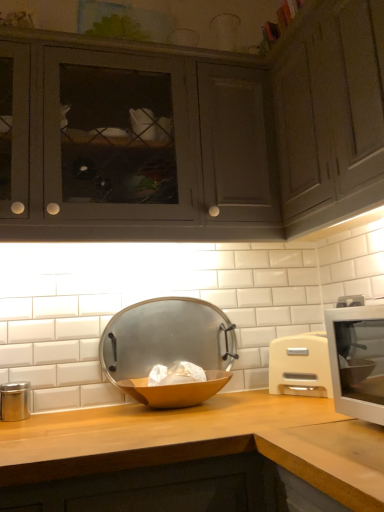
What do you see at coordinates (300, 366) in the screenshot?
I see `white plastic microwave at right` at bounding box center [300, 366].

How much space does matte gray cabinet at upper right, marked as the first cabinetry in a right-to-left arrangement, occupy horizontally?

matte gray cabinet at upper right, marked as the first cabinetry in a right-to-left arrangement, is 14.14 inches in width.

This screenshot has width=384, height=512. What do you see at coordinates (168, 348) in the screenshot? I see `metallic silver bowl at center` at bounding box center [168, 348].

Identify the location of white plastic microwave at right. (300, 366).

Which object is positioned more to the left, white plastic microwave at right or white plastic microwave at right?

From the viewer's perspective, white plastic microwave at right appears more on the left side.

Consider the image. From the image's perspective, is white plastic microwave at right above white plastic microwave at right?

Yes, from the image's perspective, white plastic microwave at right is over white plastic microwave at right.

From a real-world perspective, is white plastic microwave at right on top of white plastic microwave at right?

Yes, from a real-world perspective, white plastic microwave at right is above white plastic microwave at right.

Which of these two, wooden at center or white plastic microwave at right, is thinner?

With smaller width is white plastic microwave at right.

Find the location of `microwave oven behind the wooden at center`. microwave oven behind the wooden at center is located at coordinates (300, 366).

Considering the relative sizes of wooden at center and white plastic microwave at right in the image provided, is wooden at center bigger than white plastic microwave at right?

Correct, wooden at center is larger in size than white plastic microwave at right.

Looking at this image, from the image's perspective, is wooden at center on white plastic microwave at right?

No, from the image's perspective, wooden at center is not above white plastic microwave at right.

Which is more to the left, white plastic microwave at right or wooden bowl at center?

wooden bowl at center is more to the left.

Is white plastic microwave at right far from wooden bowl at center?

No.

Considering the sizes of objects white plastic microwave at right and wooden bowl at center in the image provided, who is wider, white plastic microwave at right or wooden bowl at center?

wooden bowl at center is wider.

Is wooden at center taller than matte gray cabinets at upper left, which ranks as the 1th cabinetry in left-to-right order?

No.

Is wooden at center wider than matte gray cabinets at upper left, which ranks as the 1th cabinetry in left-to-right order?

Yes.

Is wooden at center not within matte gray cabinets at upper left, which ranks as the 1th cabinetry in left-to-right order?

wooden at center lies outside matte gray cabinets at upper left, which ranks as the 1th cabinetry in left-to-right order,'s area.

This screenshot has width=384, height=512. What are the coordinates of `countertop below the matte gray cabinets at upper left, which ranks as the 1th cabinetry in left-to-right order (from the image's perspective)` in the screenshot? It's located at (203, 442).

Can you confirm if matte gray cabinets at upper left, which ranks as the 1th cabinetry in left-to-right order, is positioned to the right of matte gray cabinet at upper right, marked as the first cabinetry in a right-to-left arrangement?

No.

From the image's perspective, would you say matte gray cabinets at upper left, which ranks as the 1th cabinetry in left-to-right order, is shown under matte gray cabinet at upper right, marked as the first cabinetry in a right-to-left arrangement?

Result: Yes, from the image's perspective, matte gray cabinets at upper left, which ranks as the 1th cabinetry in left-to-right order, is below matte gray cabinet at upper right, marked as the first cabinetry in a right-to-left arrangement.

Is matte gray cabinets at upper left, which ranks as the 1th cabinetry in left-to-right order, wider than matte gray cabinet at upper right, marked as the first cabinetry in a right-to-left arrangement?

Yes, matte gray cabinets at upper left, which ranks as the 1th cabinetry in left-to-right order, is wider than matte gray cabinet at upper right, marked as the first cabinetry in a right-to-left arrangement.

Is metallic silver bowl at center thinner than white plastic microwave at right?

Correct, the width of metallic silver bowl at center is less than that of white plastic microwave at right.

Is metallic silver bowl at center with white plastic microwave at right?

No, metallic silver bowl at center is not in contact with white plastic microwave at right.

Does point (141, 375) appear closer or farther from the camera than point (311, 371)?

Point (141, 375).

Is metallic silver bowl at center aimed at white plastic microwave at right?

No, metallic silver bowl at center does not turn towards white plastic microwave at right.

Looking at this image, between matte gray cabinet at upper right, marked as the first cabinetry in a right-to-left arrangement, and metallic silver bowl at center, which one appears on the right side from the viewer's perspective?

matte gray cabinet at upper right, marked as the first cabinetry in a right-to-left arrangement.

Is matte gray cabinet at upper right, marked as the first cabinetry in a right-to-left arrangement, in contact with metallic silver bowl at center?

They are not placed beside each other.

Is point (369, 19) behind point (207, 362)?

No, it is in front of (207, 362).

Is matte gray cabinet at upper right, marked as the first cabinetry in a right-to-left arrangement, oriented towards metallic silver bowl at center?

No.

Locate an element on the screen. The image size is (384, 512). microwave oven to the left of white plastic microwave at right is located at coordinates (300, 366).

This screenshot has height=512, width=384. I want to click on microwave oven on the right side of wooden at center, so coord(300,366).

In the scene shown: When comparing their distances from wooden bowl at center, does wooden at center or white plastic microwave at right seem further?

white plastic microwave at right is further to wooden bowl at center.

Considering their positions, is white plastic microwave at right positioned closer to matte gray cabinets at upper left, the 2th cabinetry viewed from the right, than matte gray cabinet at upper right, which is the second cabinetry in left-to-right order?

matte gray cabinet at upper right, which is the second cabinetry in left-to-right order, is positioned closer to the anchor matte gray cabinets at upper left, the 2th cabinetry viewed from the right.

Based on their spatial positions, is metallic silver bowl at center or matte gray cabinet at upper right, which is the second cabinetry in left-to-right order, further from white plastic microwave at right?

Among the two, metallic silver bowl at center is located further to white plastic microwave at right.

From the image, which object appears to be farther from metallic silver bowl at center, white plastic microwave at right or white plastic microwave at right?

white plastic microwave at right lies further to metallic silver bowl at center than the other object.

Looking at the image, which one is located closer to wooden at center, white plastic microwave at right or white plastic microwave at right?

The object closer to wooden at center is white plastic microwave at right.

Based on their spatial positions, is white plastic microwave at right or wooden bowl at center closer to matte gray cabinet at upper right, which is the second cabinetry in left-to-right order?

Based on the image, white plastic microwave at right appears to be nearer to matte gray cabinet at upper right, which is the second cabinetry in left-to-right order.

Looking at this image, which object lies further to the anchor point white plastic microwave at right, white plastic microwave at right or wooden at center?

wooden at center lies further to white plastic microwave at right than the other object.

From the picture: Based on their spatial positions, is wooden at center or white plastic microwave at right further from matte gray cabinet at upper right, which is the second cabinetry in left-to-right order?

The object further to matte gray cabinet at upper right, which is the second cabinetry in left-to-right order, is wooden at center.

What are the coordinates of `appliance between matte gray cabinet at upper right, which is the second cabinetry in left-to-right order, and white plastic microwave at right in the up-down direction` in the screenshot? It's located at (168, 348).

The height and width of the screenshot is (512, 384). In order to click on microwave oven that lies between matte gray cabinets at upper left, the 2th cabinetry viewed from the right, and wooden bowl at center from top to bottom in this screenshot , I will do `click(300, 366)`.

Locate an element on the screen. home appliance between matte gray cabinet at upper right, which is the second cabinetry in left-to-right order, and metallic silver bowl at center in the up-down direction is located at coordinates (357, 360).

Identify the location of appliance that lies between matte gray cabinets at upper left, which ranks as the 1th cabinetry in left-to-right order, and wooden bowl at center from top to bottom. This screenshot has height=512, width=384. (168, 348).